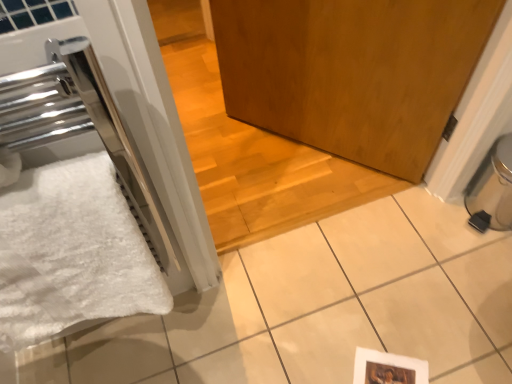
Question: Does wooden door at center come in front of black plastic water heater at lower right?

Choices:
 (A) no
 (B) yes

Answer: (A)

Question: Is wooden door at center oriented towards black plastic water heater at lower right?

Choices:
 (A) no
 (B) yes

Answer: (A)

Question: Does wooden door at center come behind black plastic water heater at lower right?

Choices:
 (A) no
 (B) yes

Answer: (B)

Question: Is wooden door at center looking in the opposite direction of black plastic water heater at lower right?

Choices:
 (A) yes
 (B) no

Answer: (B)

Question: Is wooden door at center at the left side of black plastic water heater at lower right?

Choices:
 (A) yes
 (B) no

Answer: (A)

Question: From a real-world perspective, relative to black plastic water heater at lower right, is wooden door at center vertically above or below?

Choices:
 (A) above
 (B) below

Answer: (B)

Question: From the image's perspective, is wooden door at center above or below black plastic water heater at lower right?

Choices:
 (A) below
 (B) above

Answer: (B)

Question: Is wooden door at center to the left or to the right of black plastic water heater at lower right in the image?

Choices:
 (A) left
 (B) right

Answer: (A)

Question: Considering the positions of wooden door at center and black plastic water heater at lower right in the image, is wooden door at center wider or thinner than black plastic water heater at lower right?

Choices:
 (A) wide
 (B) thin

Answer: (A)

Question: From the image's perspective, relative to white fluffy bath towel at left, is black plastic water heater at lower right above or below?

Choices:
 (A) below
 (B) above

Answer: (B)

Question: Considering the positions of black plastic water heater at lower right and white fluffy bath towel at left in the image, is black plastic water heater at lower right wider or thinner than white fluffy bath towel at left?

Choices:
 (A) thin
 (B) wide

Answer: (B)

Question: Is point (470, 201) positioned closer to the camera than point (123, 289)?

Choices:
 (A) farther
 (B) closer

Answer: (A)

Question: Visually, is black plastic water heater at lower right positioned to the left or to the right of white fluffy bath towel at left?

Choices:
 (A) left
 (B) right

Answer: (B)

Question: Considering the positions of white fluffy bath towel at left and black plastic water heater at lower right in the image, is white fluffy bath towel at left taller or shorter than black plastic water heater at lower right?

Choices:
 (A) tall
 (B) short

Answer: (A)

Question: Based on their positions, is white fluffy bath towel at left located to the left or right of black plastic water heater at lower right?

Choices:
 (A) left
 (B) right

Answer: (A)